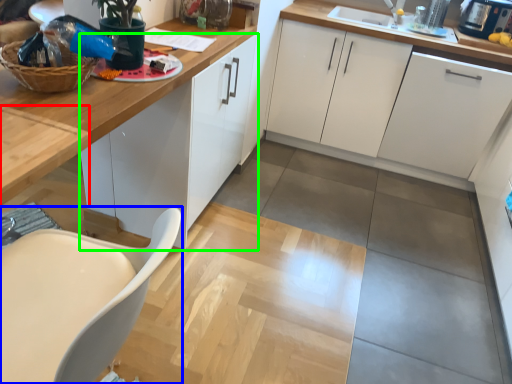
Question: Considering the real-world distances, which object is farthest from table (highlighted by a red box)? chair (highlighted by a blue box) or cabinetry (highlighted by a green box)?

Choices:
 (A) chair
 (B) cabinetry

Answer: (B)